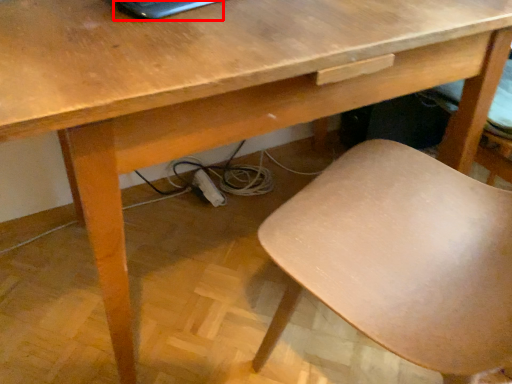
Question: From the image's perspective, where is laptop (annotated by the red box) located relative to chair?

Choices:
 (A) above
 (B) below

Answer: (A)